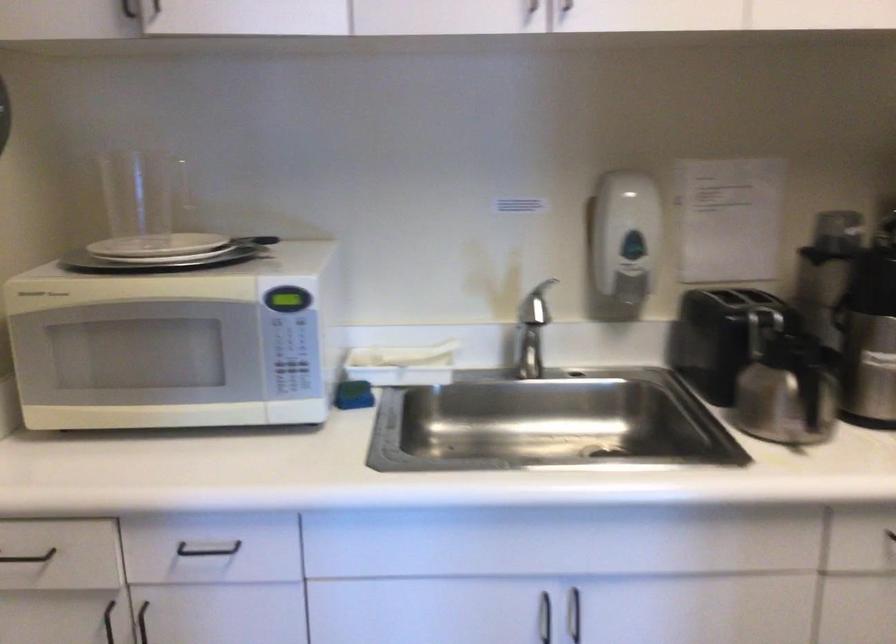
Locate an element on the screen. The image size is (896, 644). silver faucet handle is located at coordinates (536, 305).